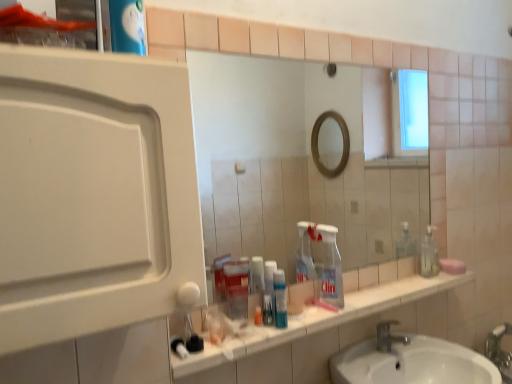
What do you see at coordinates (331, 267) in the screenshot? This screenshot has width=512, height=384. I see `clear plastic bottle at center` at bounding box center [331, 267].

What do you see at coordinates (388, 336) in the screenshot? I see `silver metallic faucet at lower center` at bounding box center [388, 336].

What do you see at coordinates (269, 293) in the screenshot?
I see `translucent plastic toothpaste at center, which ranks as the 2th bottle in front-to-back order` at bounding box center [269, 293].

Find the location of a particular element. white glossy sink at lower center is located at coordinates click(410, 361).

The image size is (512, 384). Describe the element at coordinates (237, 288) in the screenshot. I see `translucent plastic container at center, which is the first bottle in left-to-right order` at that location.

Where is `clear plastic bottle at center`? The height and width of the screenshot is (384, 512). clear plastic bottle at center is located at coordinates (331, 267).

Based on the photo, between white matte medicine cabinet at left and white glossy sink at lower center, which one has larger width?

white glossy sink at lower center is wider.

Can you confirm if white matte medicine cabinet at left is positioned to the left of white glossy sink at lower center?

Yes.

Between white matte medicine cabinet at left and white glossy sink at lower center, which one has larger size?

With larger size is white glossy sink at lower center.

From the picture: Is white glossy sink at lower center inside white matte medicine cabinet at left?

Definitely not — white glossy sink at lower center is not inside white matte medicine cabinet at left.

Considering the sizes of objects translucent plastic container at center, which ranks as the 2th bottle in back-to-front order, and silver metallic faucet at lower center in the image provided, who is thinner, translucent plastic container at center, which ranks as the 2th bottle in back-to-front order, or silver metallic faucet at lower center?

With smaller width is translucent plastic container at center, which ranks as the 2th bottle in back-to-front order.

From a real-world perspective, who is located higher, translucent plastic container at center, which is the 2th bottle in right-to-left order, or silver metallic faucet at lower center?

From a 3D spatial view, translucent plastic container at center, which is the 2th bottle in right-to-left order, is above.

From a real-world perspective, starting from the silver metallic faucet at lower center, which bottle is the 2nd one vertically above it? Please provide its 2D coordinates.

[(237, 288)]

Considering the relative sizes of white glossy sink at lower center and translucent plastic container at center, which ranks as the 2th bottle in back-to-front order, in the image provided, is white glossy sink at lower center wider than translucent plastic container at center, which ranks as the 2th bottle in back-to-front order,?

Indeed, white glossy sink at lower center has a greater width compared to translucent plastic container at center, which ranks as the 2th bottle in back-to-front order.

Measure the distance between white glossy sink at lower center and translucent plastic container at center, which ranks as the 2th bottle in back-to-front order.

The distance of white glossy sink at lower center from translucent plastic container at center, which ranks as the 2th bottle in back-to-front order, is 24.18 inches.

Starting from the white glossy sink at lower center, which bottle is the 1st one behind? Please provide its 2D coordinates.

[(237, 288)]

Based on the photo, does white glossy sink at lower center turn towards translucent plastic container at center, which is the 2th bottle in right-to-left order?

No, white glossy sink at lower center is not oriented towards translucent plastic container at center, which is the 2th bottle in right-to-left order.

From the picture: From the image's perspective, which one is positioned lower, translucent plastic container at center, which ranks as the 2th bottle in back-to-front order, or white glossy sink at lower center?

white glossy sink at lower center is shown below in the image.

The width and height of the screenshot is (512, 384). What are the coordinates of `bottle that is the 2nd one above the white glossy sink at lower center (from a real-world perspective)` in the screenshot? It's located at (237, 288).

Is translucent plastic container at center, which ranks as the 2th bottle in back-to-front order, shorter than white glossy sink at lower center?

Yes.

What's the angular difference between clear plastic bottle at center and pink matte soap at right's facing directions?

clear plastic bottle at center and pink matte soap at right are facing 0.00258 degrees away from each other.

In terms of height, does clear plastic bottle at center look taller or shorter compared to pink matte soap at right?

In the image, clear plastic bottle at center appears to be taller than pink matte soap at right.

Is clear plastic bottle at center thinner than pink matte soap at right?

Correct, the width of clear plastic bottle at center is less than that of pink matte soap at right.

Is clear plastic bottle at center touching pink matte soap at right?

clear plastic bottle at center and pink matte soap at right are clearly separated.

Considering the relative sizes of white matte medicine cabinet at left and pink matte soap at right in the image provided, is white matte medicine cabinet at left wider than pink matte soap at right?

Yes.

Is white matte medicine cabinet at left to the left or to the right of pink matte soap at right in the image?

white matte medicine cabinet at left is to the left of pink matte soap at right.

Measure the distance between white matte medicine cabinet at left and pink matte soap at right.

They are 1.41 meters apart.

Does clear plastic bottle at center lie in front of white matte medicine cabinet at left?

No, clear plastic bottle at center is behind white matte medicine cabinet at left.

Who is bigger, clear plastic bottle at center or white matte medicine cabinet at left?

With larger size is white matte medicine cabinet at left.

Based on their positions, is clear plastic bottle at center located to the left or right of white matte medicine cabinet at left?

In the image, clear plastic bottle at center appears on the right side of white matte medicine cabinet at left.

Does clear plastic bottle at center have a lesser width compared to white matte medicine cabinet at left?

Indeed, clear plastic bottle at center has a lesser width compared to white matte medicine cabinet at left.

This screenshot has width=512, height=384. I want to click on sink behind the white matte medicine cabinet at left, so click(410, 361).

I want to click on the 1st bottle above when counting from the silver metallic faucet at lower center (from the image's perspective), so click(x=237, y=288).

From the image, which object appears to be farther from silver metallic faucet at lower center, white glossy sink at lower center or pink matte soap at right?

pink matte soap at right is further to silver metallic faucet at lower center.

From the image, which object appears to be nearer to white glossy sink at lower center, translucent plastic toothpaste at center, which ranks as the 2th bottle in front-to-back order, or clear plastic bottle at center?

The object closer to white glossy sink at lower center is clear plastic bottle at center.

Considering their positions, is translucent plastic toothpaste at center, the second bottle when ordered from left to right, positioned closer to clear plastic bottle at center than silver metallic faucet at lower center?

translucent plastic toothpaste at center, the second bottle when ordered from left to right, lies closer to clear plastic bottle at center than the other object.

Based on their spatial positions, is translucent plastic container at center, which is the first bottle in left-to-right order, or pink matte soap at right further from clear plastic bottle at center?

The object further to clear plastic bottle at center is pink matte soap at right.

Based on their spatial positions, is silver metallic faucet at lower center or translucent plastic container at center, which is the 2th bottle in right-to-left order, closer to white glossy sink at lower center?

silver metallic faucet at lower center is closer to white glossy sink at lower center.

Looking at the image, which one is located further to clear plastic bottle at center, white glossy sink at lower center or white matte medicine cabinet at left?

white matte medicine cabinet at left.

Estimate the real-world distances between objects in this image. Which object is further from translucent plastic container at center, which is the 2th bottle in right-to-left order, clear plastic bottle at center or white glossy sink at lower center?

white glossy sink at lower center.

From the image, which object appears to be nearer to clear plastic bottle at center, pink matte soap at right or white matte medicine cabinet at left?

pink matte soap at right is closer to clear plastic bottle at center.

Find the location of a particular element. Image resolution: width=512 pixels, height=384 pixels. cleaning product between translucent plastic toothpaste at center, the first bottle when ordered from right to left, and pink matte soap at right, in the horizontal direction is located at coordinates (331, 267).

At what (x,y) coordinates should I click in order to perform the action: click on cleaning product between translucent plastic toothpaste at center, the first bottle when ordered from right to left, and silver metallic faucet at lower center, in the horizontal direction. Please return your answer as a coordinate pair (x, y). The image size is (512, 384). Looking at the image, I should click on (331, 267).

Identify the location of sink between translucent plastic toothpaste at center, which ranks as the 2th bottle in front-to-back order, and pink matte soap at right from left to right. (410, 361).

Find the location of `bottle located between white matte medicine cabinet at left and translucent plastic toothpaste at center, the second bottle when ordered from left to right, in the depth direction`. bottle located between white matte medicine cabinet at left and translucent plastic toothpaste at center, the second bottle when ordered from left to right, in the depth direction is located at coordinates (237, 288).